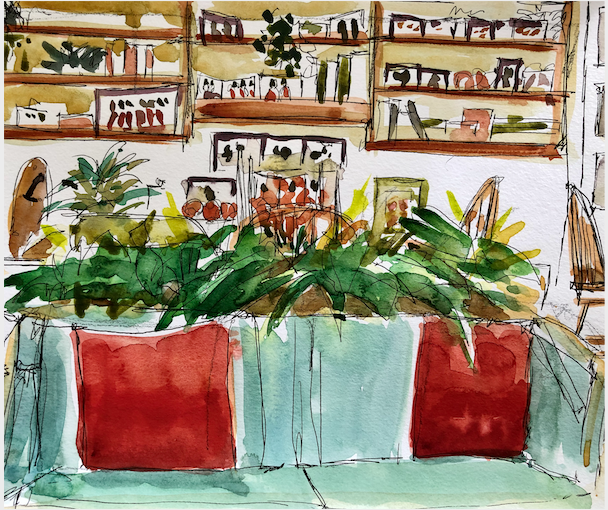
Where is `1 right pillow`? The height and width of the screenshot is (510, 608). 1 right pillow is located at coordinates (480, 396).